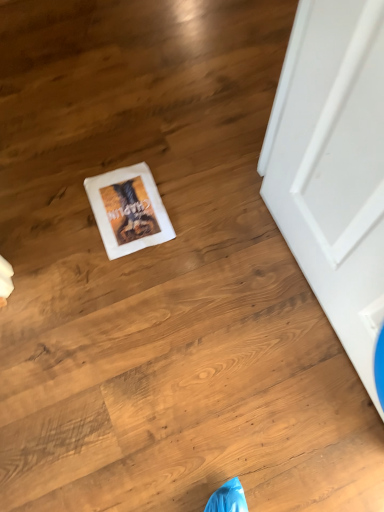
Image resolution: width=384 pixels, height=512 pixels. What are the coordinates of `vacant area situated below white paper postcard at center (from a real-world perspective)` in the screenshot? It's located at (128, 211).